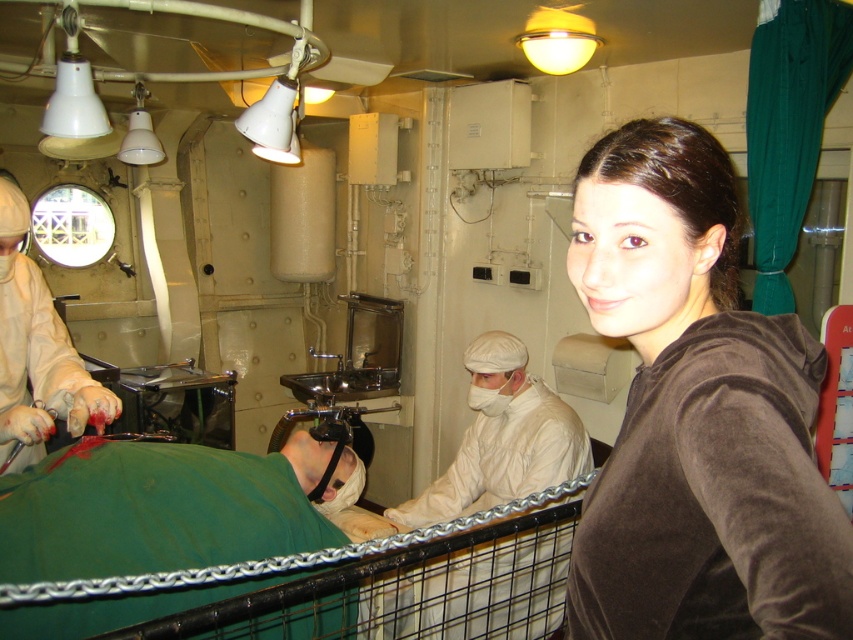
Who is lower down, white matte uniform at center or white matte surgical gown at center?

white matte uniform at center is below.

Is white matte uniform at center taller than white matte surgical gown at center?

Yes, white matte uniform at center is taller than white matte surgical gown at center.

This screenshot has width=853, height=640. I want to click on white matte uniform at center, so click(502, 438).

Can you confirm if brown velvety shirt at upper right is positioned to the left of white matte surgical gown at center?

In fact, brown velvety shirt at upper right is to the right of white matte surgical gown at center.

Which is behind, point (718, 339) or point (16, 349)?

The point (16, 349) is more distant.

Is point (663, 454) positioned in front of point (42, 307)?

Yes, it is in front of point (42, 307).

Where is `brown velvety shirt at upper right`? brown velvety shirt at upper right is located at coordinates (695, 413).

Is point (631, 320) closer to viewer compared to point (544, 451)?

Yes, it is.

Can you confirm if brown velvety shirt at upper right is positioned to the right of white matte uniform at center?

Correct, you'll find brown velvety shirt at upper right to the right of white matte uniform at center.

Measure the distance between point (675, 552) and camera.

The distance of point (675, 552) from camera is 30.30 inches.

At what (x,y) coordinates should I click in order to perform the action: click on brown velvety shirt at upper right. Please return your answer as a coordinate pair (x, y). The image size is (853, 640). Looking at the image, I should click on (695, 413).